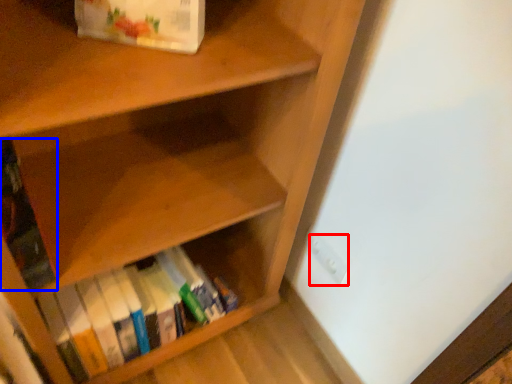
Question: Which of the following is the farthest to the observer, electric outlet (highlighted by a red box) or book (highlighted by a blue box)?

Choices:
 (A) electric outlet
 (B) book

Answer: (A)